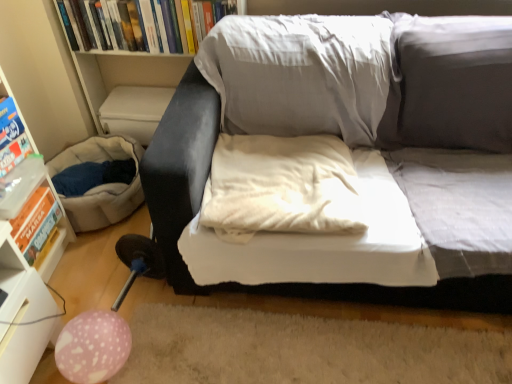
Question: Is beige fabric bean bag at lower left smaller than matte gray couch at center?

Choices:
 (A) yes
 (B) no

Answer: (A)

Question: Considering the relative sizes of beige fabric bean bag at lower left and matte gray couch at center in the image provided, is beige fabric bean bag at lower left wider than matte gray couch at center?

Choices:
 (A) yes
 (B) no

Answer: (B)

Question: Is beige fabric bean bag at lower left located outside matte gray couch at center?

Choices:
 (A) no
 (B) yes

Answer: (B)

Question: Does beige fabric bean bag at lower left have a lesser height compared to matte gray couch at center?

Choices:
 (A) no
 (B) yes

Answer: (B)

Question: Is beige fabric bean bag at lower left facing away from matte gray couch at center?

Choices:
 (A) no
 (B) yes

Answer: (A)

Question: Is point (12, 140) closer or farther from the camera than point (38, 193)?

Choices:
 (A) closer
 (B) farther

Answer: (A)

Question: From a real-world perspective, relative to orange cardboard book at left, marked as the first paperback book in a bottom-to-top arrangement, is matte blue paperback book at left, the second paperback book ordered from the bottom, vertically above or below?

Choices:
 (A) below
 (B) above

Answer: (B)

Question: Is matte blue paperback book at left, which ranks as the second paperback book in top-to-bottom order, inside the boundaries of orange cardboard book at left, marked as the first paperback book in a bottom-to-top arrangement, or outside?

Choices:
 (A) outside
 (B) inside

Answer: (A)

Question: Looking at their shapes, would you say matte blue paperback book at left, which ranks as the second paperback book in top-to-bottom order, is wider or thinner than orange cardboard book at left, marked as the first paperback book in a bottom-to-top arrangement?

Choices:
 (A) thin
 (B) wide

Answer: (A)

Question: In terms of width, does matte blue paperback book at left, which ranks as the second paperback book in top-to-bottom order, look wider or thinner when compared to white soft pillow at center?

Choices:
 (A) wide
 (B) thin

Answer: (B)

Question: Considering their positions, is matte blue paperback book at left, which ranks as the second paperback book in top-to-bottom order, located in front of or behind white soft pillow at center?

Choices:
 (A) behind
 (B) front

Answer: (A)

Question: Considering the relative positions of matte blue paperback book at left, which ranks as the second paperback book in top-to-bottom order, and white soft pillow at center in the image provided, is matte blue paperback book at left, which ranks as the second paperback book in top-to-bottom order, to the left or to the right of white soft pillow at center?

Choices:
 (A) left
 (B) right

Answer: (A)

Question: Considering the positions of matte blue paperback book at left, which ranks as the second paperback book in top-to-bottom order, and white soft pillow at center in the image, is matte blue paperback book at left, which ranks as the second paperback book in top-to-bottom order, bigger or smaller than white soft pillow at center?

Choices:
 (A) small
 (B) big

Answer: (A)

Question: In terms of width, does pink dotted balloon at lower left look wider or thinner when compared to white plastic shelf at left?

Choices:
 (A) thin
 (B) wide

Answer: (A)

Question: Is pink dotted balloon at lower left taller or shorter than white plastic shelf at left?

Choices:
 (A) tall
 (B) short

Answer: (B)